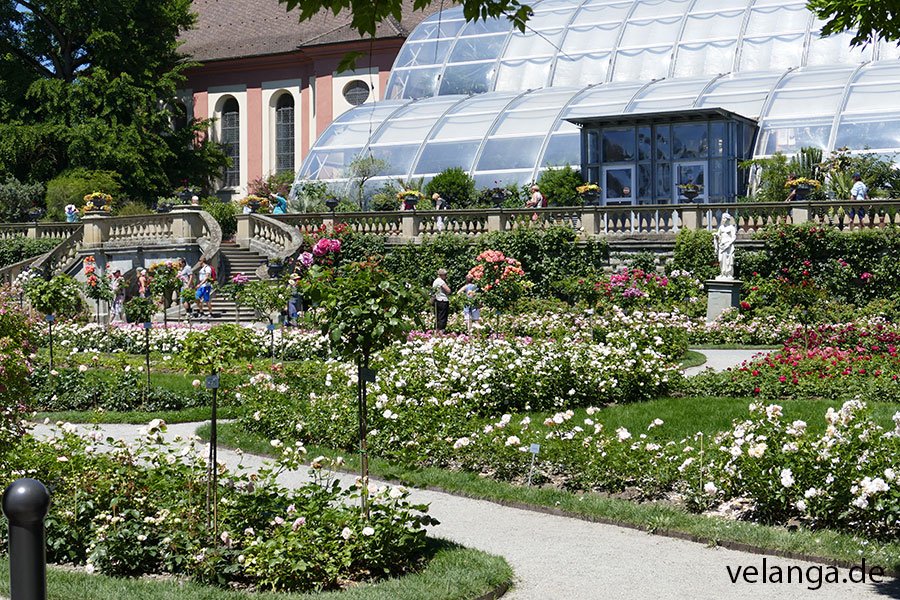
At what (x,y) coordinates should I click in order to perform the action: click on stairs. Please return your answer as a coordinate pair (x, y). This screenshot has height=600, width=900. Looking at the image, I should click on (221, 280), (48, 288).